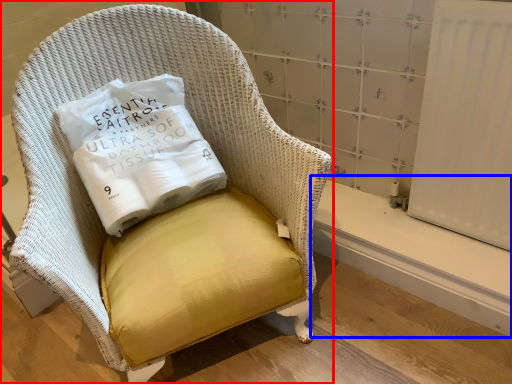
Question: Which object appears closest to the camera in this image, chair (highlighted by a red box) or window sill (highlighted by a blue box)?

Choices:
 (A) chair
 (B) window sill

Answer: (A)